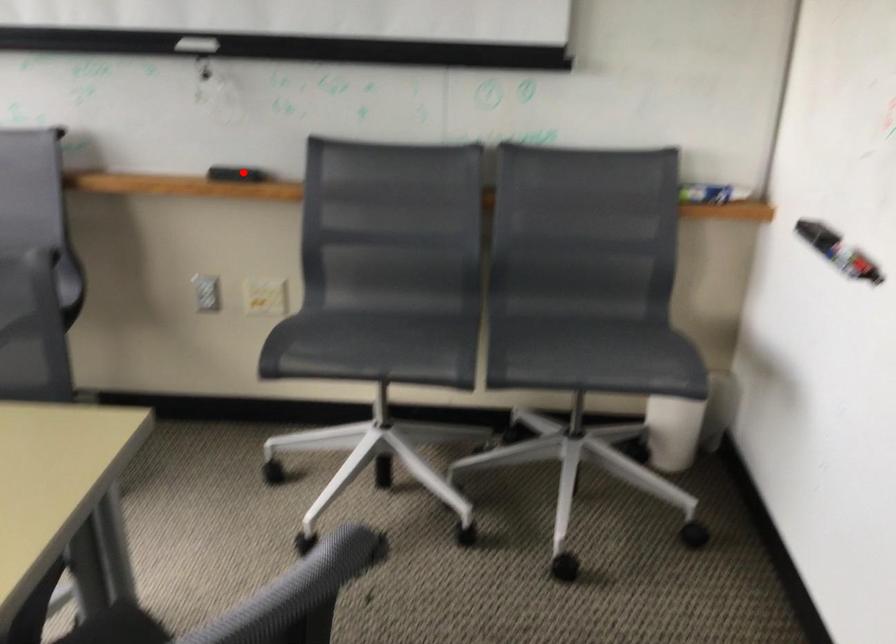
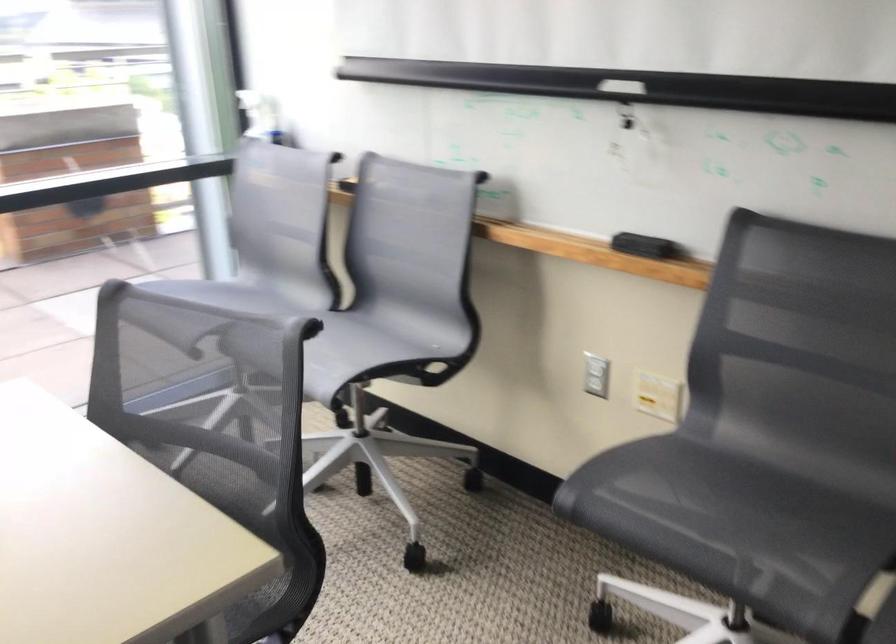
Find the pixel in the second image that matches the highlighted location in the first image.

(643, 245)